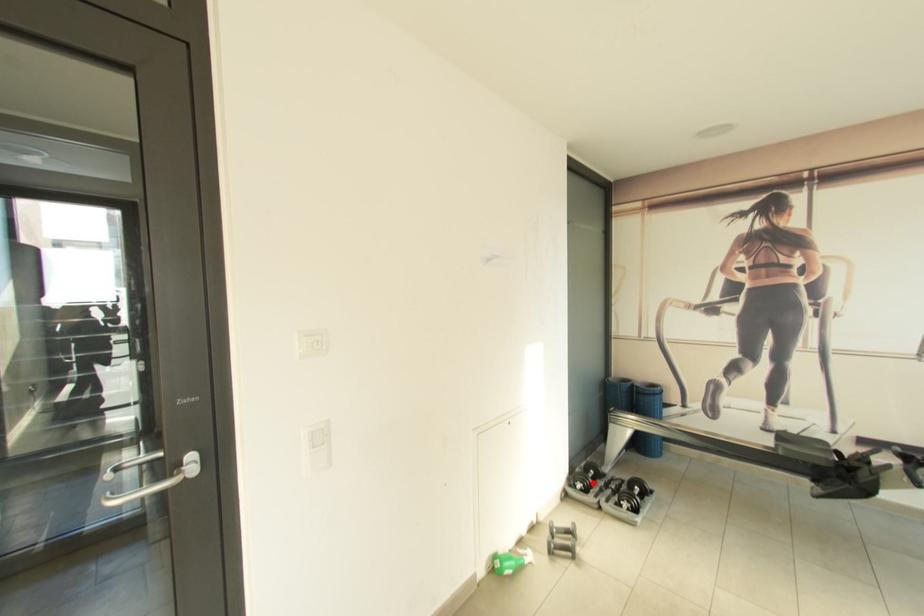
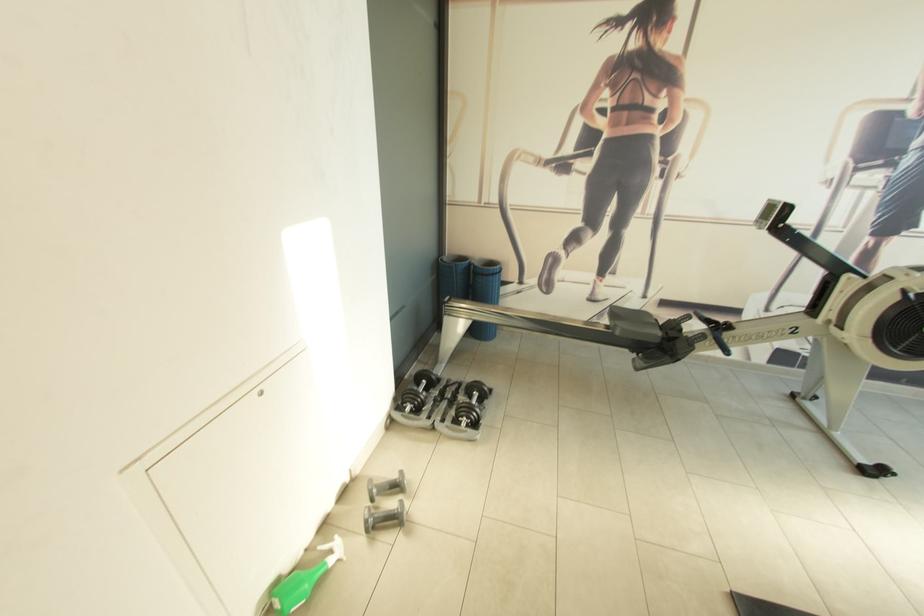
The point at the highlighted location is marked in the first image. Where is the corresponding point in the second image?

(424, 402)